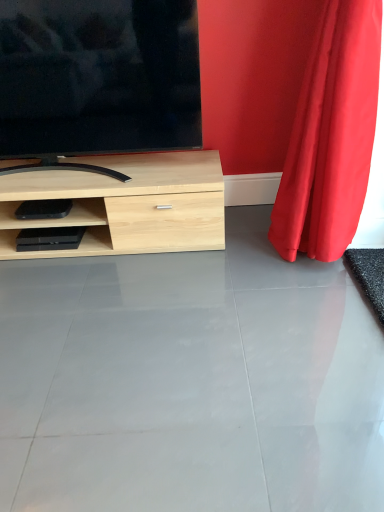
Identify the location of free point below red velvet curtain at right (from a real-world perspective). The height and width of the screenshot is (512, 384). (316, 271).